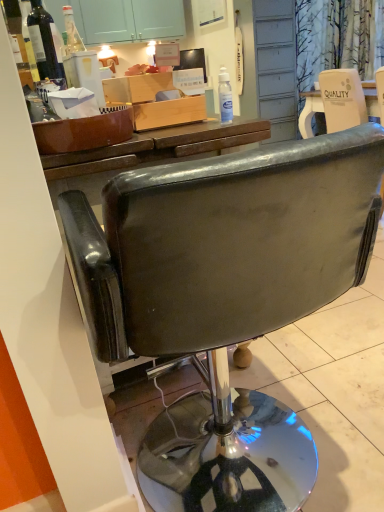
Question: Is matte black television at upper center inside the boundaries of dark glass bottle at upper left, which is the first bottle in left-to-right order, or outside?

Choices:
 (A) outside
 (B) inside

Answer: (A)

Question: From a real-world perspective, is matte black television at upper center physically located above or below dark glass bottle at upper left, which is the first bottle in left-to-right order?

Choices:
 (A) below
 (B) above

Answer: (A)

Question: Which object is the closest to the dark glass bottle at upper left, which is the first bottle from top to bottom?

Choices:
 (A) transparent plastic bottle at upper center, placed as the second bottle when sorted from top to bottom
 (B) wooden box at center
 (C) white paper bag at upper right
 (D) leather-like black chair at center
 (E) matte black television at upper center

Answer: (B)

Question: Estimate the real-world distances between objects in this image. Which object is closer to the wooden box at center?

Choices:
 (A) dark glass bottle at upper left, which is the second bottle in right-to-left order
 (B) transparent plastic bottle at upper center, positioned as the second bottle in left-to-right order
 (C) white paper bag at upper right
 (D) matte black television at upper center
 (E) leather-like black chair at center

Answer: (D)